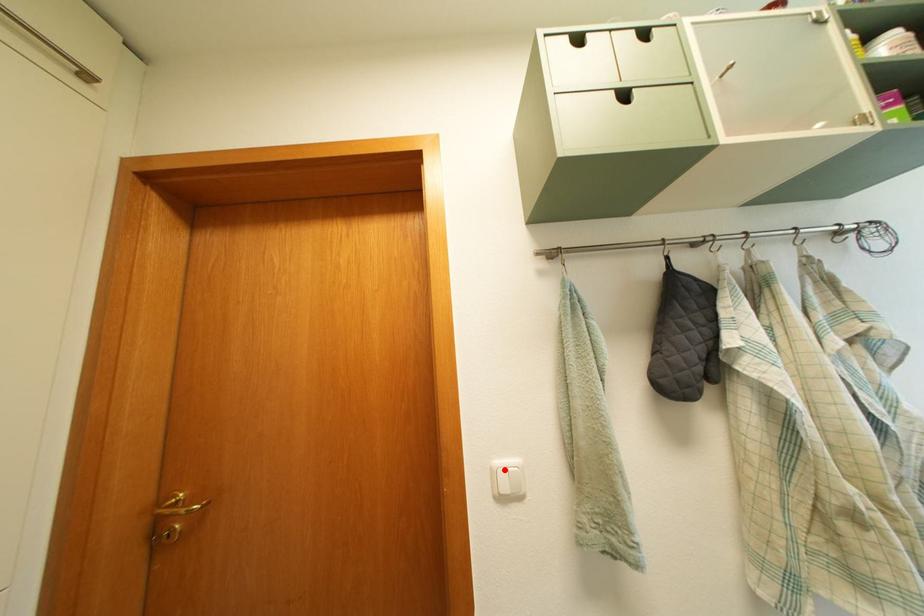
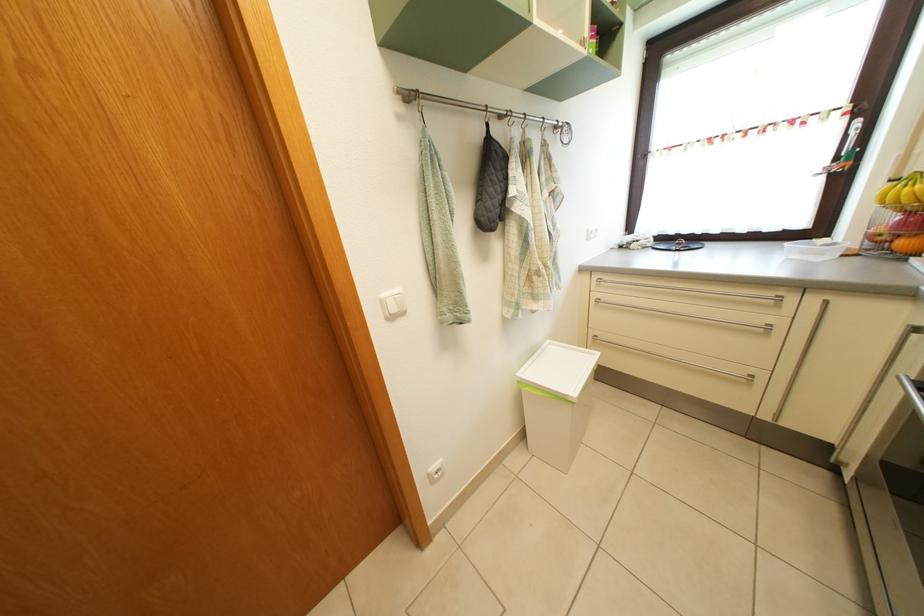
Question: I am providing you with two images of the same scene from different viewpoints. A red point is marked on the first image. Can you still see the location of the red point in image 2?

Choices:
 (A) Yes
 (B) No

Answer: (A)